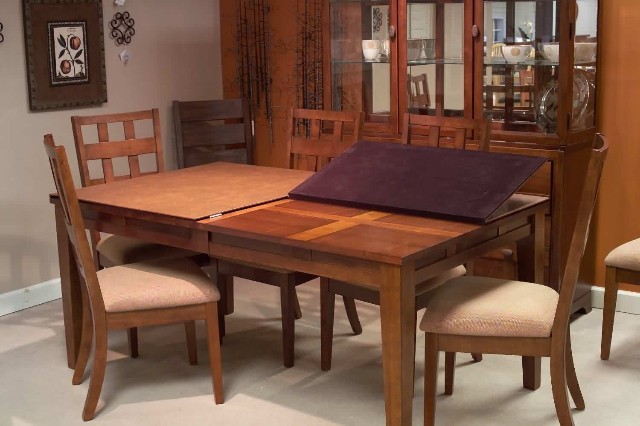
The image size is (640, 426). I want to click on table cover, so click(x=218, y=180), click(x=422, y=185), click(x=525, y=200).